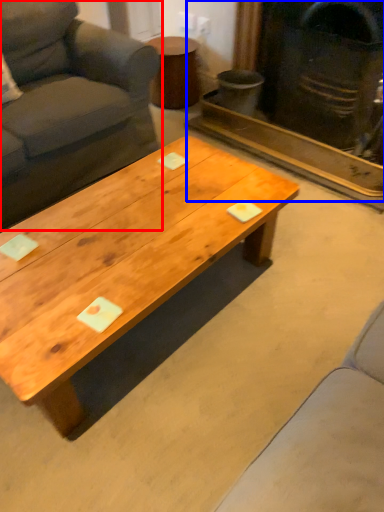
Question: Which of the following is the farthest to the observer, studio couch (highlighted by a red box) or fireplace (highlighted by a blue box)?

Choices:
 (A) studio couch
 (B) fireplace

Answer: (B)